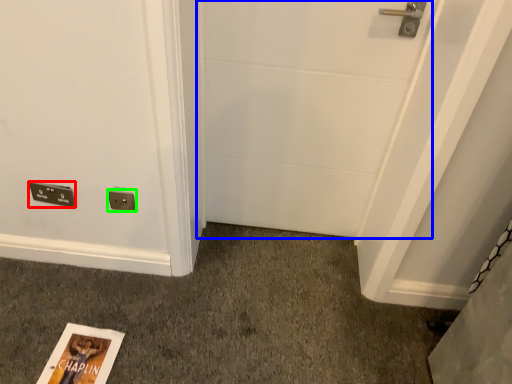
Question: Estimate the real-world distances between objects in this image. Which object is farther from light switch (highlighted by a red box), door (highlighted by a blue box) or electric outlet (highlighted by a green box)?

Choices:
 (A) door
 (B) electric outlet

Answer: (A)